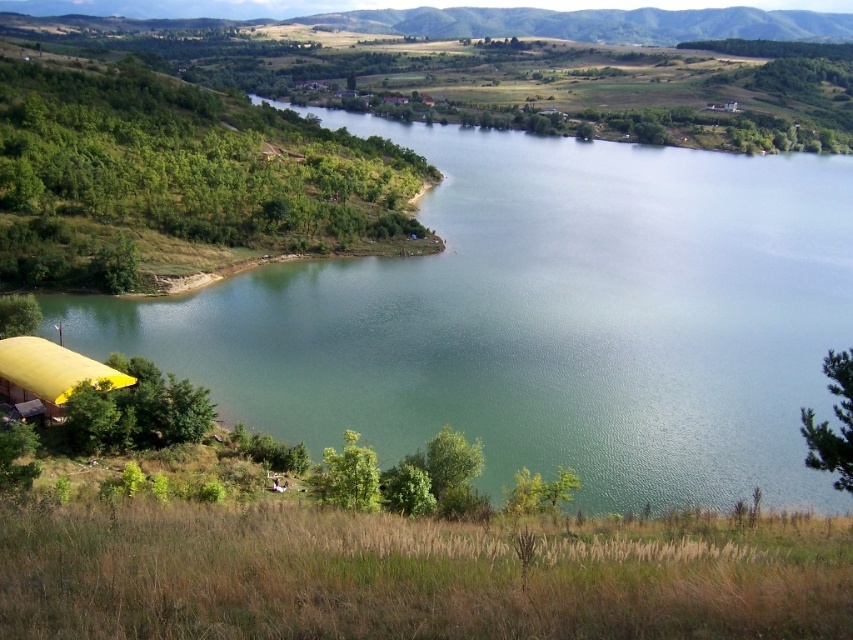
Which of these two, green water at center or yellow fabric tent at lower left, stands taller?

green water at center is taller.

Is green water at center to the right of yellow fabric tent at lower left from the viewer's perspective?

Correct, you'll find green water at center to the right of yellow fabric tent at lower left.

Identify the location of green water at center. This screenshot has height=640, width=853. point(544,321).